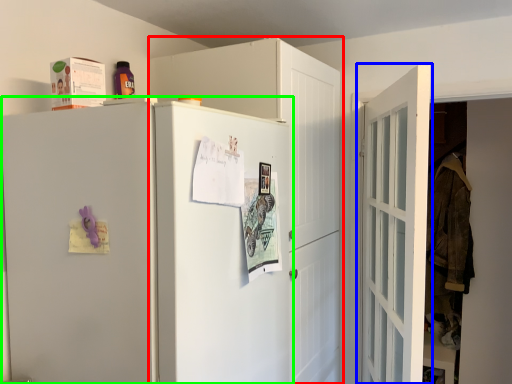
Question: Which object is the closest to the cabinetry (highlighted by a red box)? Choose among these: door (highlighted by a blue box) or refrigerator (highlighted by a green box).

Choices:
 (A) door
 (B) refrigerator

Answer: (B)